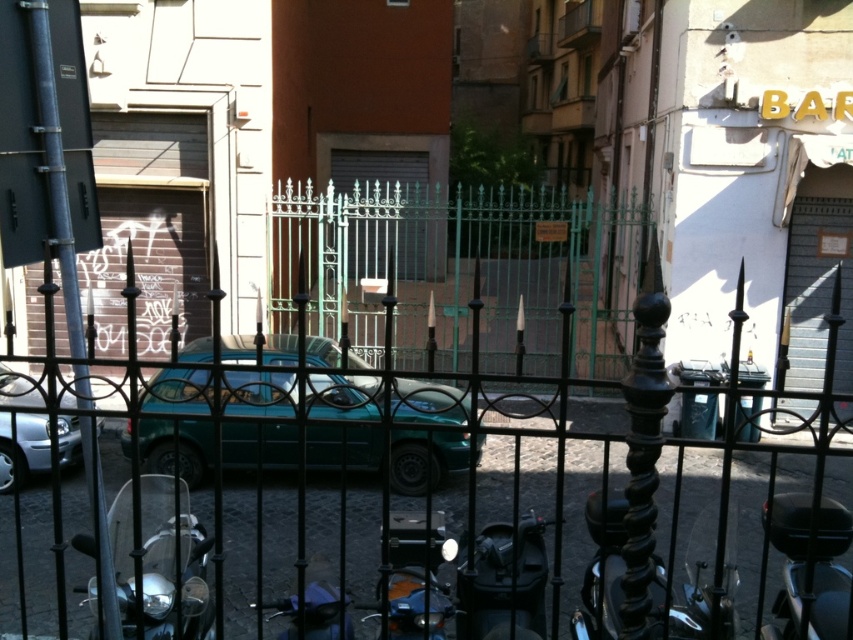
You are a delivery person trying to navigate through the black wrought iron fence at center and the metallic silver car at left. Which object would you need to go around if you want to pass through the area?

You would need to go around the black wrought iron fence at center because it has a larger size compared to the metallic silver car at left, making it a bigger obstruction in your path.

You are standing in front of the black wrought iron fence at center. If you want to walk to the teal car parked on the street beyond the fence, which direction should you move relative to the fence?

Since the teal car is parked on the street beyond the fence, you should move forward through or around the black wrought iron fence at center to reach it.

You are standing in front of a black wrought iron fence with vertical bars and decorative finials. You see a point marked at coordinates (343, 396). What object is located at that point?

The point at coordinates (343, 396) corresponds to the teal matte car at center.